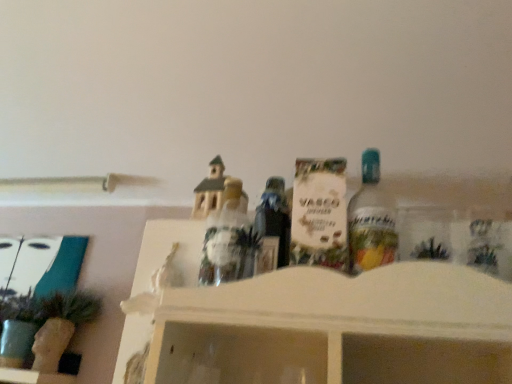
Question: Is translucent plastic figurine at center, the third toy from the right, in front of or behind matte brown house at center, the second toy positioned from the left, in the image?

Choices:
 (A) behind
 (B) front

Answer: (B)

Question: From the image's perspective, relative to matte brown house at center, the second toy positioned from the left, is translucent plastic figurine at center, the third toy from the right, above or below?

Choices:
 (A) above
 (B) below

Answer: (B)

Question: Estimate the real-world distances between objects in this image. Which object is closer to the clear glass bottle at center-right?

Choices:
 (A) matte brown house at center, the 2th toy positioned from the right
 (B) white matte box at center, arranged as the first toy when viewed from the right
 (C) translucent plastic figurine at center, the first toy positioned from the left

Answer: (B)

Question: Considering the real-world distances, which object is closest to the clear glass bottle at center-right?

Choices:
 (A) translucent plastic figurine at center, the third toy from the right
 (B) white matte box at center, placed as the third toy when sorted from left to right
 (C) matte brown house at center, the second toy positioned from the left

Answer: (B)